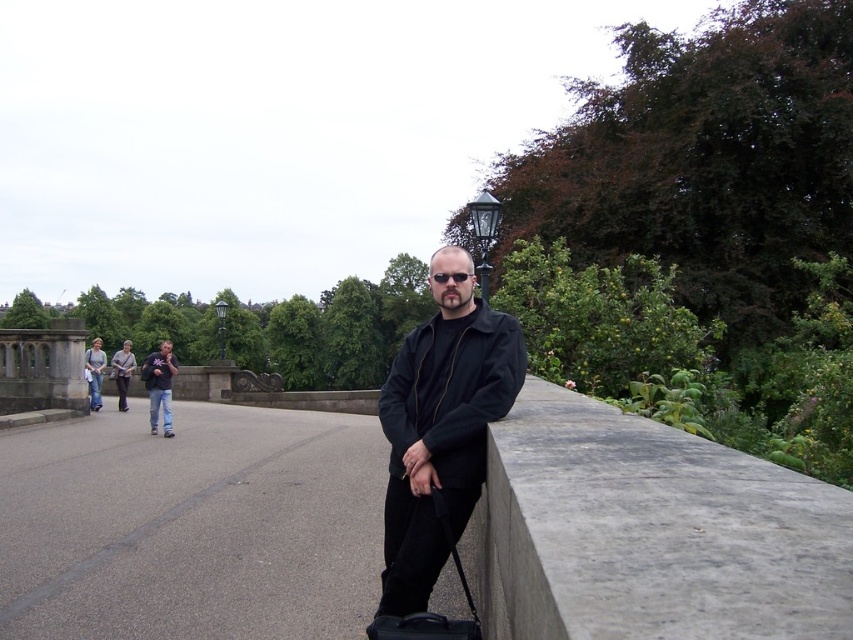
Can you confirm if dark blue jeans at left is shorter than dark gray jacket at center?

Indeed, dark blue jeans at left has a lesser height compared to dark gray jacket at center.

The image size is (853, 640). Find the location of `dark blue jeans at left`. dark blue jeans at left is located at coordinates (160, 385).

Does black matte jacket at center come in front of dark blue jeans at left?

Yes, it is in front of dark blue jeans at left.

Does black matte jacket at center appear on the left side of dark blue jeans at left?

No, black matte jacket at center is not to the left of dark blue jeans at left.

Who is more distant from viewer, (409, 385) or (155, 381)?

The point (155, 381) is behind.

You are a GUI agent. You are given a task and a screenshot of the screen. Output one action in this format:
    pyautogui.click(x=<x>, y=<y>)
    Task: Click on the black matte jacket at center
    Image resolution: width=853 pixels, height=640 pixels.
    Given the screenshot: What is the action you would take?
    pyautogui.click(x=440, y=428)

Does black matte jacket at center have a lesser width compared to dark gray jacket at center?

Correct, black matte jacket at center's width is less than dark gray jacket at center's.

Between point (457, 289) and point (125, 378), which one is positioned behind?

The point (125, 378) is more distant.

Is point (450, 387) closer to viewer compared to point (120, 392)?

Yes, it is.

Where is `black matte jacket at center`? black matte jacket at center is located at coordinates (440, 428).